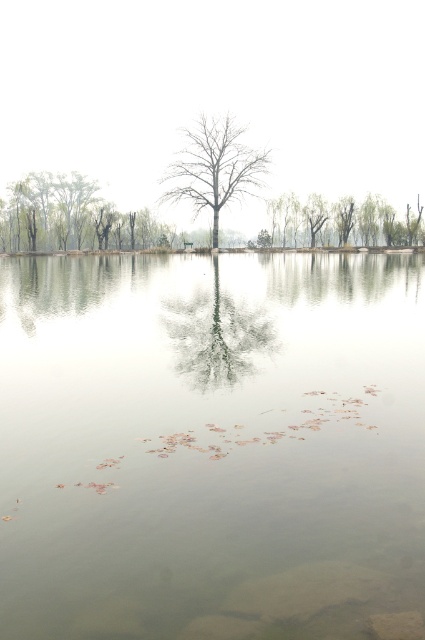
You are a photographer planning to take a wide shot of the scene. You want to ensure that both the clear water at center and the bare wood tree at center are clearly visible in the frame. Given their sizes, which object will occupy more of the photograph?

The clear water at center has a larger size compared to the bare wood tree at center, so it will occupy more of the photograph.

You are standing at the lakeside and want to reach the green leafy tree at center. Which direction should you move to get closer to it, considering the clear water at center is between you and the tree?

You should move away from the clear water at center because it is closer to you than the green leafy tree at center, meaning the tree is further back. Moving away from the water would bring you closer to the tree.